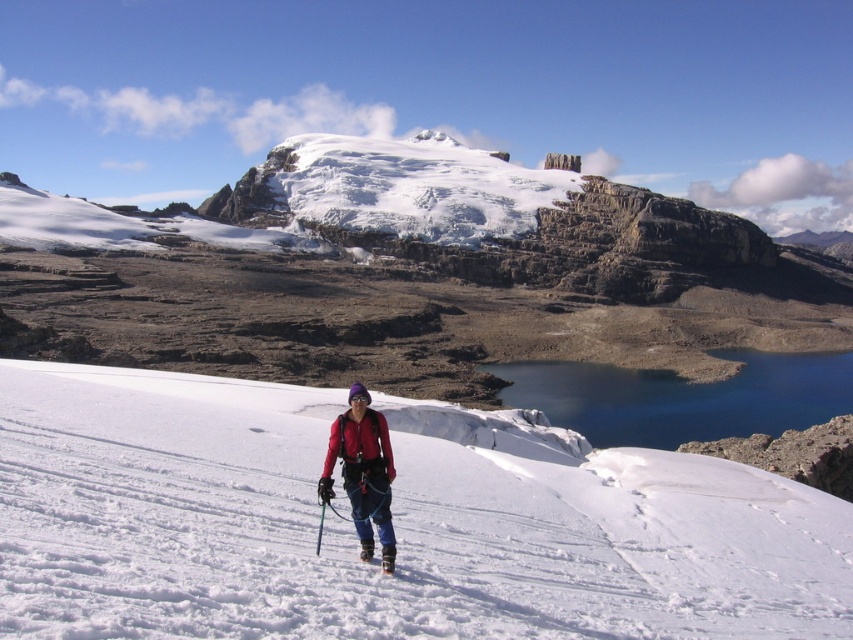
Question: Can you confirm if matte red jacket at center is positioned to the left of white matte ski at lower center?

Choices:
 (A) no
 (B) yes

Answer: (B)

Question: Which point is farther to the camera?

Choices:
 (A) matte red jacket at center
 (B) white snow at center
 (C) white matte ski at lower center

Answer: (A)

Question: Is white snow at center to the right of blue glassy lake at center from the viewer's perspective?

Choices:
 (A) no
 (B) yes

Answer: (A)

Question: Which point is closer to the camera?

Choices:
 (A) (201, 554)
 (B) (387, 564)

Answer: (A)

Question: Does blue glassy lake at center appear on the right side of white matte ski at lower center?

Choices:
 (A) no
 (B) yes

Answer: (B)

Question: Among these objects, which one is farthest from the camera?

Choices:
 (A) matte red jacket at center
 (B) blue glassy lake at center
 (C) white matte ski at lower center

Answer: (B)